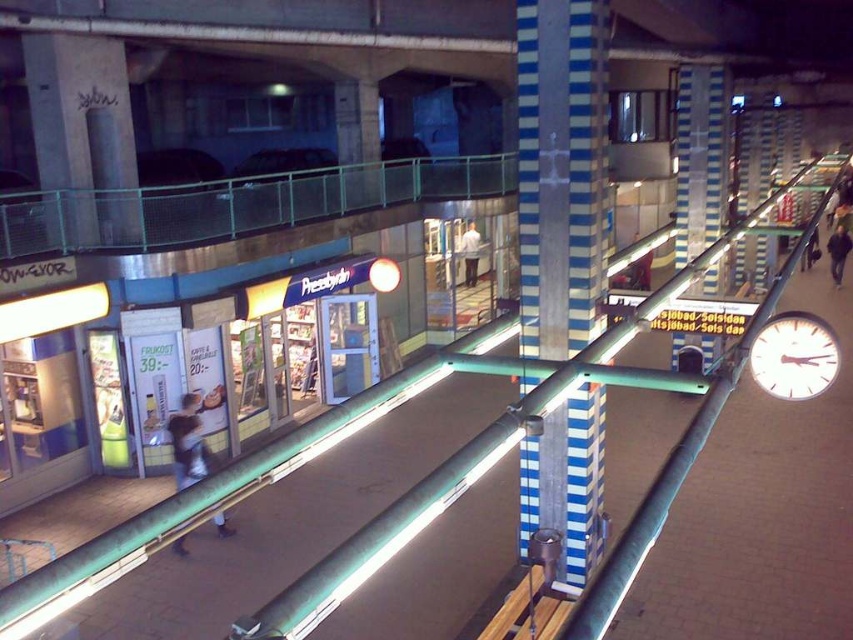
Question: Which point is closer to the camera?

Choices:
 (A) blue striped pillar at center
 (B) denim jacket at lower left
 (C) white metallic clock at right

Answer: (C)

Question: In this image, where is white metallic clock at right located relative to white matte shirt at center?

Choices:
 (A) left
 (B) right

Answer: (B)

Question: Which object is farther from the camera taking this photo?

Choices:
 (A) white metallic clock at right
 (B) dark blue jacket at lower right
 (C) white matte shirt at center

Answer: (B)

Question: Is white metallic clock at right above denim jacket at lower left?

Choices:
 (A) yes
 (B) no

Answer: (A)

Question: Is blue striped pillar at center further to the viewer compared to denim jacket at lower left?

Choices:
 (A) no
 (B) yes

Answer: (A)

Question: Based on their relative distances, which object is farther from the dark blue jacket at lower right?

Choices:
 (A) white metallic clock at right
 (B) white matte shirt at center
 (C) blue striped pillar at center

Answer: (C)